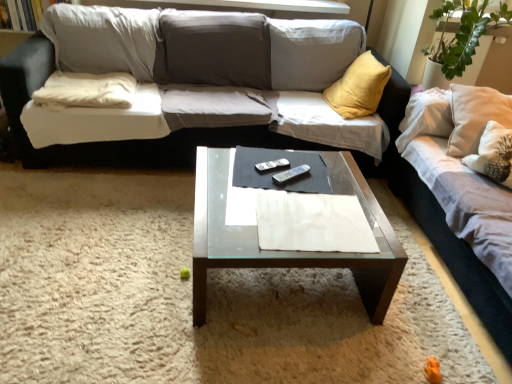
Identify the location of vacant region to the right of black plastic remote at center, which ranks as the first remote in bottom-to-top order. click(x=329, y=181).